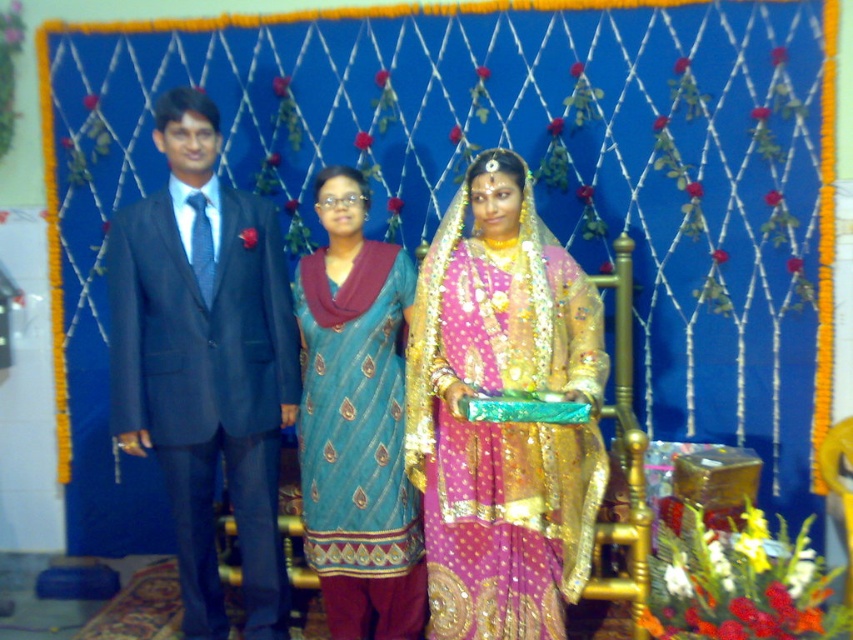
Between point (364, 602) and point (339, 212), which one is positioned in front?

Point (339, 212) is more forward.

This screenshot has height=640, width=853. What do you see at coordinates (462, 426) in the screenshot? I see `shiny gold saree at center` at bounding box center [462, 426].

Measure the distance between shiny gold saree at center and camera.

shiny gold saree at center is 7.63 feet from camera.

The width and height of the screenshot is (853, 640). I want to click on shiny gold saree at center, so click(x=462, y=426).

Image resolution: width=853 pixels, height=640 pixels. I want to click on shiny gold saree at center, so click(462, 426).

Is pink satin saree at center smaller than teal silk kurta at center?

No, pink satin saree at center is not smaller than teal silk kurta at center.

Measure the distance between point (x=469, y=208) and camera.

They are 2.75 meters apart.

You are a GUI agent. You are given a task and a screenshot of the screen. Output one action in this format:
    pyautogui.click(x=<x>, y=<y>)
    Task: Click on the pink satin saree at center
    
    Given the screenshot: What is the action you would take?
    pyautogui.click(x=502, y=422)